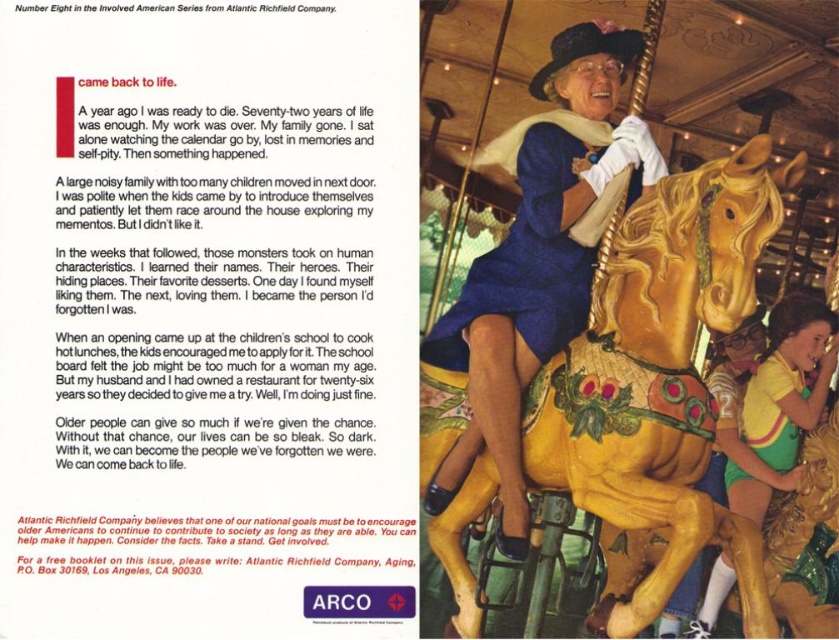
Is golden polished wood horse at center wider than blue satin dress at center?

No.

Between golden polished wood horse at center and blue satin dress at center, which one is positioned higher?

blue satin dress at center

Where is `golden polished wood horse at center`? The image size is (839, 640). golden polished wood horse at center is located at coordinates (659, 376).

Is golden polished wood horse at center below yellow-green jersey at right?

Incorrect, golden polished wood horse at center is not positioned below yellow-green jersey at right.

What do you see at coordinates (659, 376) in the screenshot? The image size is (839, 640). I see `golden polished wood horse at center` at bounding box center [659, 376].

In order to click on golden polished wood horse at center in this screenshot , I will do `click(659, 376)`.

Is blue satin dress at center above yellow-green jersey at right?

Yes.

Does blue satin dress at center appear on the left side of yellow-green jersey at right?

Correct, you'll find blue satin dress at center to the left of yellow-green jersey at right.

Does point (550, 346) lie in front of point (694, 630)?

That is True.

I want to click on blue satin dress at center, so click(x=537, y=262).